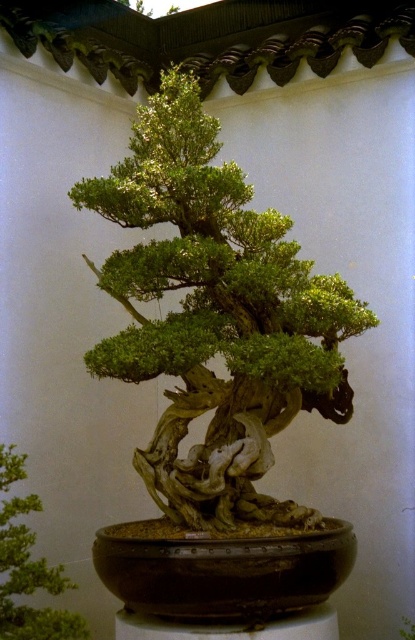
Question: Does green textured bonsai at center have a lesser width compared to green matte bonsai tree at center?

Choices:
 (A) no
 (B) yes

Answer: (A)

Question: Can you confirm if green textured bonsai at center is positioned above green matte bonsai tree at center?

Choices:
 (A) yes
 (B) no

Answer: (A)

Question: Can you confirm if green textured bonsai at center is smaller than green matte bonsai tree at center?

Choices:
 (A) no
 (B) yes

Answer: (A)

Question: Which of the following is the closest to the observer?

Choices:
 (A) (282, 378)
 (B) (53, 614)

Answer: (B)